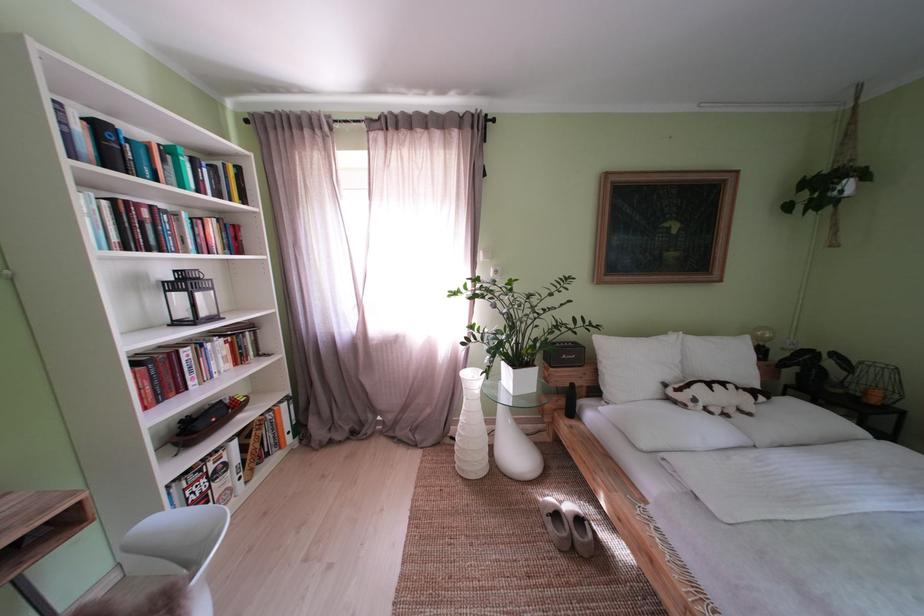
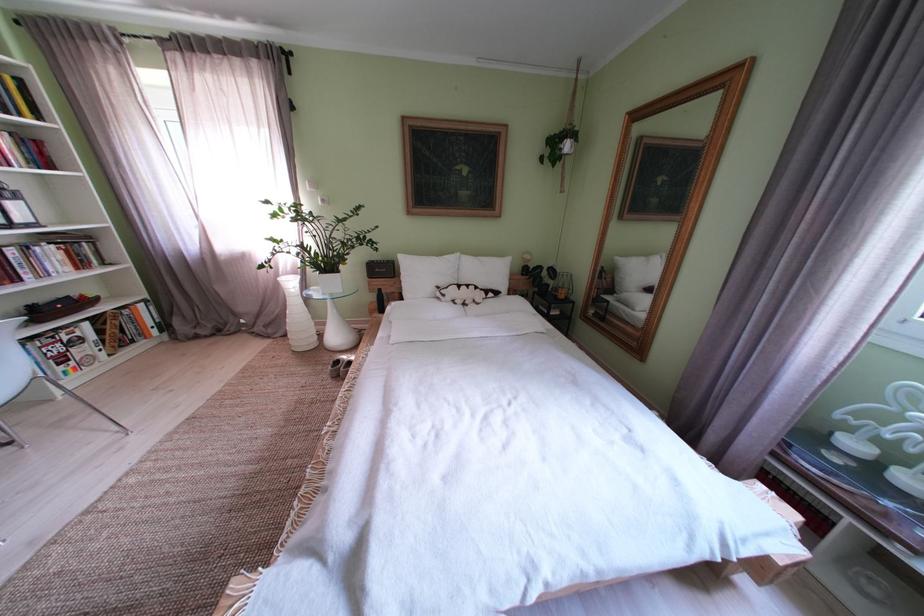
Locate, in the second image, the point that corresponds to point 225,231 in the first image.

(16, 145)